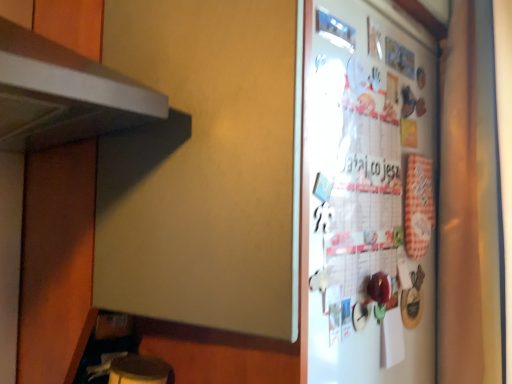
This screenshot has width=512, height=384. What do you see at coordinates (470, 205) in the screenshot?
I see `white fabric curtain at right` at bounding box center [470, 205].

Measure the distance between point (487, 142) and camera.

96.60 centimeters.

You are a GUI agent. You are given a task and a screenshot of the screen. Output one action in this format:
    pyautogui.click(x=<x>, y=<y>)
    Task: Click on the white fabric curtain at right
    
    Given the screenshot: What is the action you would take?
    pyautogui.click(x=470, y=205)

The image size is (512, 384). I want to click on white glossy refrigerator at right, so click(x=367, y=196).

Describe the element at coordinates (367, 196) in the screenshot. The width and height of the screenshot is (512, 384). I see `white glossy refrigerator at right` at that location.

In order to face white glossy refrigerator at right, should I rotate leftwards or rightwards?

Rotate right and turn 18.090 degrees.

In the scene shown: Measure the distance between white glossy refrigerator at right and camera.

white glossy refrigerator at right and camera are 24.22 inches apart.

You are a GUI agent. You are given a task and a screenshot of the screen. Output one action in this format:
    pyautogui.click(x=<x>, y=<y>)
    Task: Click on the white fabric curtain at right
    Image resolution: width=512 pixels, height=384 pixels.
    Given the screenshot: What is the action you would take?
    pyautogui.click(x=470, y=205)

Is white fabric curtain at right to the left of white glossy refrigerator at right from the viewer's perspective?

Incorrect, white fabric curtain at right is not on the left side of white glossy refrigerator at right.

Is white fabric curtain at right behind white glossy refrigerator at right?

That is True.

Which is in front, point (473, 284) or point (373, 316)?

The point (373, 316) is closer.

From the image's perspective, would you say white fabric curtain at right is shown under white glossy refrigerator at right?

No.

From a real-world perspective, who is located higher, white fabric curtain at right or white glossy refrigerator at right?

white fabric curtain at right, from a real-world perspective.

Can you confirm if white fabric curtain at right is wider than white glossy refrigerator at right?

Indeed, white fabric curtain at right has a greater width compared to white glossy refrigerator at right.

Considering the sizes of objects white fabric curtain at right and white glossy refrigerator at right in the image provided, who is taller, white fabric curtain at right or white glossy refrigerator at right?

white fabric curtain at right.

Does white fabric curtain at right have a smaller size compared to white glossy refrigerator at right?

Actually, white fabric curtain at right might be larger than white glossy refrigerator at right.

Can white glossy refrigerator at right be found inside white fabric curtain at right?

No, white glossy refrigerator at right is not surrounded by white fabric curtain at right.

Is the surface of white fabric curtain at right in direct contact with white glossy refrigerator at right?

No, white fabric curtain at right is not beside white glossy refrigerator at right.

Is white fabric curtain at right aimed at white glossy refrigerator at right?

Yes, white fabric curtain at right is facing white glossy refrigerator at right.

Can you tell me how much white fabric curtain at right and white glossy refrigerator at right differ in facing direction?

The angle between the facing direction of white fabric curtain at right and the facing direction of white glossy refrigerator at right is 86.5 degrees.

Identify the location of curtain above the white glossy refrigerator at right (from a real-world perspective). This screenshot has width=512, height=384. click(x=470, y=205).

Based on the photo, is white glossy refrigerator at right to the right of white fabric curtain at right from the viewer's perspective?

In fact, white glossy refrigerator at right is to the left of white fabric curtain at right.

Considering the positions of objects white glossy refrigerator at right and white fabric curtain at right in the image provided, who is behind, white glossy refrigerator at right or white fabric curtain at right?

white fabric curtain at right is further from the camera.

Which is further, (316, 345) or (481, 104)?

Positioned behind is point (481, 104).

From the image's perspective, who appears lower, white glossy refrigerator at right or white fabric curtain at right?

white glossy refrigerator at right, from the image's perspective.

From a real-world perspective, is white glossy refrigerator at right above or below white fabric curtain at right?

In terms of real-world spatial position, white glossy refrigerator at right is below white fabric curtain at right.

Between white glossy refrigerator at right and white fabric curtain at right, which one has larger width?

With larger width is white fabric curtain at right.

Considering the relative sizes of white glossy refrigerator at right and white fabric curtain at right in the image provided, is white glossy refrigerator at right taller than white fabric curtain at right?

In fact, white glossy refrigerator at right may be shorter than white fabric curtain at right.

Which of these two, white glossy refrigerator at right or white fabric curtain at right, is smaller?

Smaller between the two is white glossy refrigerator at right.

Is white glossy refrigerator at right situated inside white fabric curtain at right or outside?

The correct answer is: outside.

Is white glossy refrigerator at right not near white fabric curtain at right?

That's not correct — white glossy refrigerator at right is a little close to white fabric curtain at right.

Is white fabric curtain at right at the back of white glossy refrigerator at right?

white glossy refrigerator at right does not have its back to white fabric curtain at right.

You are a GUI agent. You are given a task and a screenshot of the screen. Output one action in this format:
    pyautogui.click(x=<x>, y=<y>)
    Task: Click on the curtain to the right of white glossy refrigerator at right
    
    Given the screenshot: What is the action you would take?
    pyautogui.click(x=470, y=205)

I want to click on refrigerator below the white fabric curtain at right (from the image's perspective), so click(367, 196).

Locate an element on the screen. This screenshot has height=384, width=512. curtain located behind the white glossy refrigerator at right is located at coordinates (470, 205).